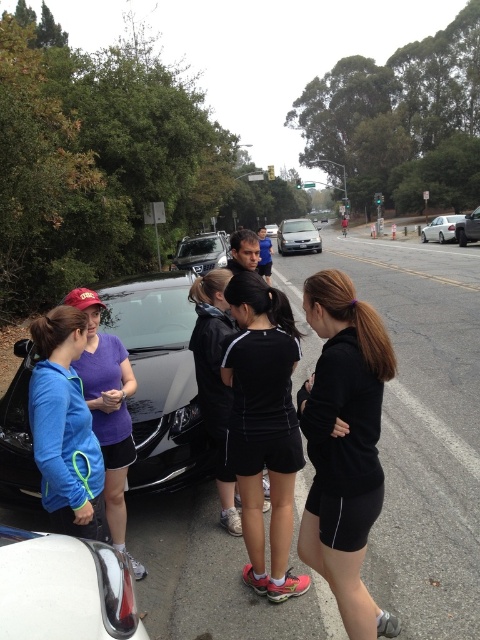
Is point (361, 461) closer to camera compared to point (90, 348)?

Yes, point (361, 461) is in front of point (90, 348).

Is black matte shorts at center bigger than matte blue jacket at left?

No, black matte shorts at center is not bigger than matte blue jacket at left.

Is point (321, 456) closer to viewer compared to point (96, 330)?

Yes, it is in front of point (96, 330).

I want to click on black matte shorts at center, so click(344, 444).

Between blue fleece jacket at left and satin black suv at center, which one has more height?

With more height is satin black suv at center.

Who is positioned more to the left, blue fleece jacket at left or satin black suv at center?

From the viewer's perspective, satin black suv at center appears more on the left side.

What do you see at coordinates (64, 428) in the screenshot?
I see `blue fleece jacket at left` at bounding box center [64, 428].

I want to click on blue fleece jacket at left, so point(64,428).

Can you confirm if black matte shorts at center is positioned below shiny black car at center?

Indeed, black matte shorts at center is positioned under shiny black car at center.

Which is behind, point (332, 385) or point (176, 305)?

The point (176, 305) is more distant.

Where is `black matte shorts at center`? This screenshot has height=640, width=480. black matte shorts at center is located at coordinates (344, 444).